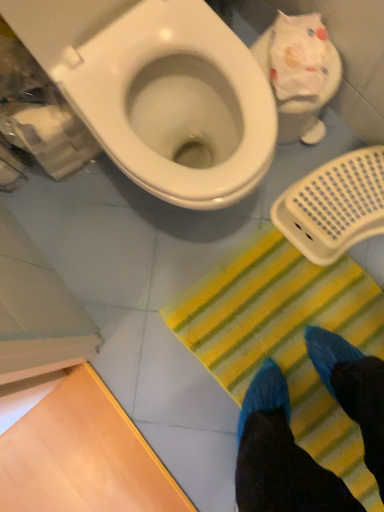
Question: From the image's perspective, relative to white plastic toilet at upper right, which is counted as the second toilet, starting from the left, is white glossy toilet at upper left, the first toilet viewed from the left, above or below?

Choices:
 (A) above
 (B) below

Answer: (B)

Question: Considering their positions, is white glossy toilet at upper left, the first toilet viewed from the left, located in front of or behind white plastic toilet at upper right, which is counted as the second toilet, starting from the left?

Choices:
 (A) front
 (B) behind

Answer: (A)

Question: Estimate the real-world distances between objects in this image. Which object is farther from the white plastic toilet at upper right, which is counted as the second toilet, starting from the left?

Choices:
 (A) yellow striped mat at lower center
 (B) white glossy toilet at upper left, the first toilet viewed from the left

Answer: (A)

Question: Estimate the real-world distances between objects in this image. Which object is farther from the white glossy toilet at upper left, the first toilet viewed from the left?

Choices:
 (A) white plastic toilet at upper right, which is counted as the second toilet, starting from the left
 (B) yellow striped mat at lower center

Answer: (B)